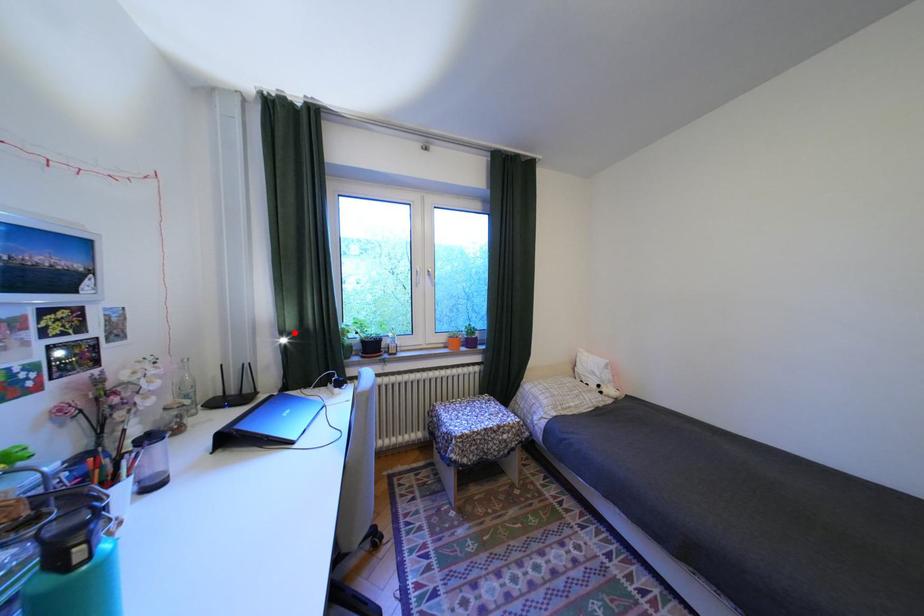
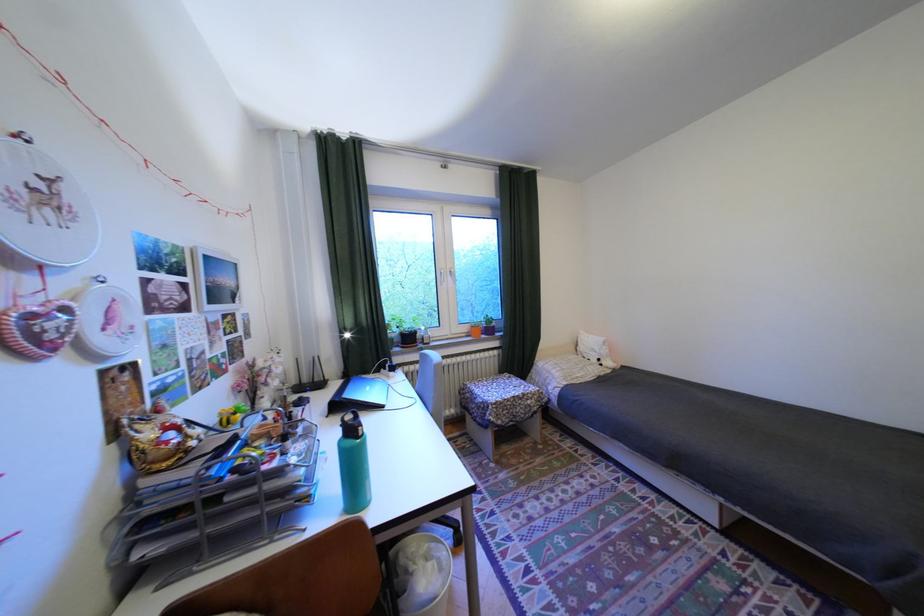
Find the pixel in the second image that matches the highlighted location in the first image.

(354, 330)